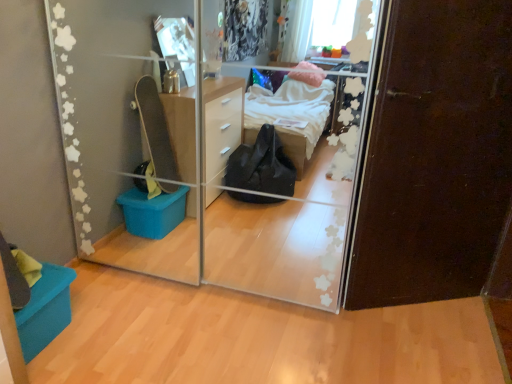
Question: From the image's perspective, is teal fabric storage box at lower left below transparent glass door at center?

Choices:
 (A) no
 (B) yes

Answer: (B)

Question: Is teal fabric storage box at lower left further to camera compared to transparent glass door at center?

Choices:
 (A) no
 (B) yes

Answer: (B)

Question: Considering the relative positions of teal fabric storage box at lower left and transparent glass door at center in the image provided, is teal fabric storage box at lower left to the left of transparent glass door at center from the viewer's perspective?

Choices:
 (A) no
 (B) yes

Answer: (B)

Question: Considering the relative sizes of teal fabric storage box at lower left and transparent glass door at center in the image provided, is teal fabric storage box at lower left taller than transparent glass door at center?

Choices:
 (A) no
 (B) yes

Answer: (A)

Question: Considering the relative sizes of teal fabric storage box at lower left and transparent glass door at center in the image provided, is teal fabric storage box at lower left wider than transparent glass door at center?

Choices:
 (A) yes
 (B) no

Answer: (B)

Question: Does teal fabric storage box at lower left touch transparent glass door at center?

Choices:
 (A) no
 (B) yes

Answer: (A)

Question: Is transparent glass door at center positioned behind teal fabric storage box at lower left?

Choices:
 (A) yes
 (B) no

Answer: (B)

Question: Could teal fabric storage box at lower left be considered to be inside transparent glass door at center?

Choices:
 (A) yes
 (B) no

Answer: (B)

Question: Is transparent glass door at center taller than teal fabric storage box at lower left?

Choices:
 (A) no
 (B) yes

Answer: (B)

Question: Could you tell me if transparent glass door at center is turned towards teal fabric storage box at lower left?

Choices:
 (A) yes
 (B) no

Answer: (A)

Question: Is transparent glass door at center bigger than teal fabric storage box at lower left?

Choices:
 (A) no
 (B) yes

Answer: (B)

Question: From the image's perspective, is transparent glass door at center on top of teal fabric storage box at lower left?

Choices:
 (A) no
 (B) yes

Answer: (B)

Question: Is transparent glass door at center at the left side of dark brown wood door at right?

Choices:
 (A) no
 (B) yes

Answer: (B)